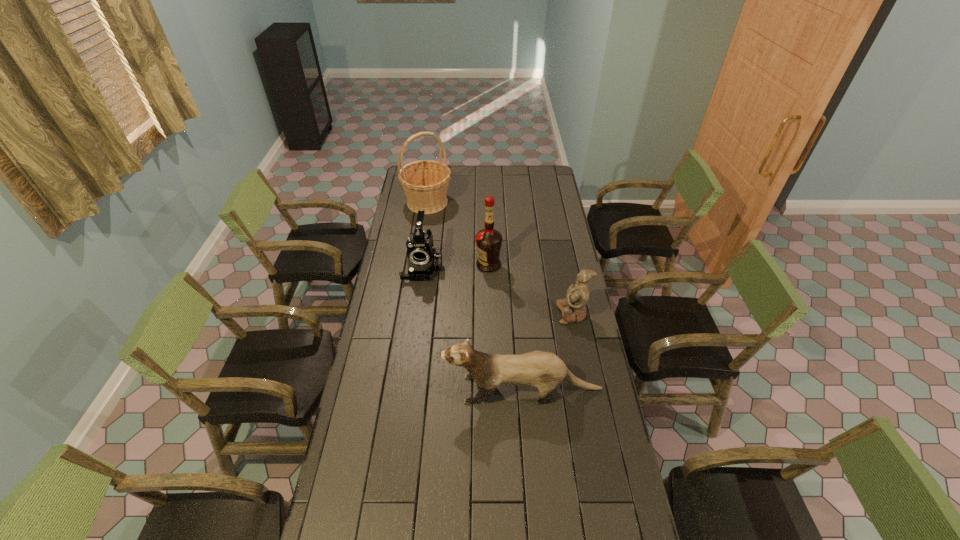
Identify the location of free space located 0.070m on the face of the nearest object. Image resolution: width=960 pixels, height=540 pixels. (424, 389).

Where is `free region located on the face of the nearest object`? The width and height of the screenshot is (960, 540). free region located on the face of the nearest object is located at coordinates (381, 389).

Image resolution: width=960 pixels, height=540 pixels. Find the location of `vacant space located on the lens mount of the camcorder`. vacant space located on the lens mount of the camcorder is located at coordinates (415, 323).

The width and height of the screenshot is (960, 540). I want to click on vacant space positioned 0.100m on the front-facing side of the figurine, so click(534, 314).

At what (x,y) coordinates should I click in order to perform the action: click on vacant space situated on the front-facing side of the figurine. Please return your answer as a coordinate pair (x, y). This screenshot has height=540, width=960. Looking at the image, I should click on click(501, 314).

Identify the location of free spot located on the front-facing side of the figurine. This screenshot has width=960, height=540. pos(511,314).

Locate an element on the screen. The height and width of the screenshot is (540, 960). basket that is positioned at the left edge is located at coordinates (425, 182).

Locate an element on the screen. camcorder at the left edge is located at coordinates (423, 260).

The height and width of the screenshot is (540, 960). Identify the location of ferret that is at the right edge. (544, 370).

Identify the location of figurine at the right edge. (573, 309).